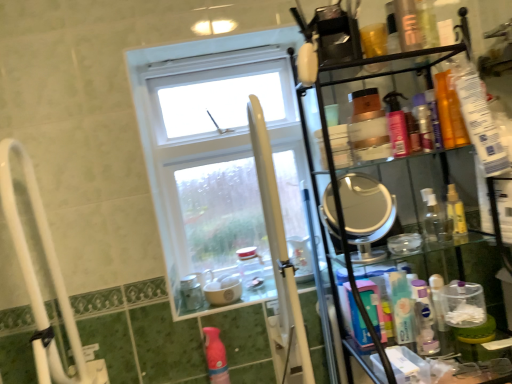
Question: Does white plastic pole at center have a lesser width compared to translucent orange bottle at upper right, positioned as the first mouthwash in top-to-bottom order?

Choices:
 (A) no
 (B) yes

Answer: (A)

Question: Is there a large distance between white plastic pole at center and translucent orange bottle at upper right, positioned as the first mouthwash in top-to-bottom order?

Choices:
 (A) no
 (B) yes

Answer: (A)

Question: Is white plastic pole at center oriented towards translucent orange bottle at upper right, the fifth mouthwash positioned from the bottom?

Choices:
 (A) no
 (B) yes

Answer: (A)

Question: Is translucent orange bottle at upper right, the fifth mouthwash positioned from the bottom, a part of white plastic pole at center?

Choices:
 (A) no
 (B) yes

Answer: (A)

Question: Does white plastic pole at center come behind translucent orange bottle at upper right, the fourth mouthwash viewed from the left?

Choices:
 (A) yes
 (B) no

Answer: (B)

Question: Is white plastic pole at center smaller than translucent orange bottle at upper right, positioned as the first mouthwash in top-to-bottom order?

Choices:
 (A) yes
 (B) no

Answer: (B)

Question: Considering the relative sizes of shiny orange bottle at upper right, the 2th toiletry viewed from the back, and white plastic pole at center in the image provided, is shiny orange bottle at upper right, the 2th toiletry viewed from the back, shorter than white plastic pole at center?

Choices:
 (A) yes
 (B) no

Answer: (A)

Question: From the image's perspective, is shiny orange bottle at upper right, the 1th toiletry from the front, on white plastic pole at center?

Choices:
 (A) yes
 (B) no

Answer: (A)

Question: Is shiny orange bottle at upper right, the 2th toiletry viewed from the back, further to camera compared to white plastic pole at center?

Choices:
 (A) no
 (B) yes

Answer: (B)

Question: Considering the relative sizes of shiny orange bottle at upper right, the 2th toiletry viewed from the back, and white plastic pole at center in the image provided, is shiny orange bottle at upper right, the 2th toiletry viewed from the back, thinner than white plastic pole at center?

Choices:
 (A) yes
 (B) no

Answer: (A)

Question: Does shiny orange bottle at upper right, the 2th toiletry viewed from the back, appear on the left side of white plastic pole at center?

Choices:
 (A) yes
 (B) no

Answer: (B)

Question: Does shiny orange bottle at upper right, the 1th toiletry from the front, have a greater height compared to white plastic pole at center?

Choices:
 (A) no
 (B) yes

Answer: (A)

Question: Could shiny orange bottle at upper right, the 2th toiletry viewed from the back, be considered to be inside white matte mouthwash at right, the 4th mouthwash in the top-to-bottom sequence?

Choices:
 (A) yes
 (B) no

Answer: (B)